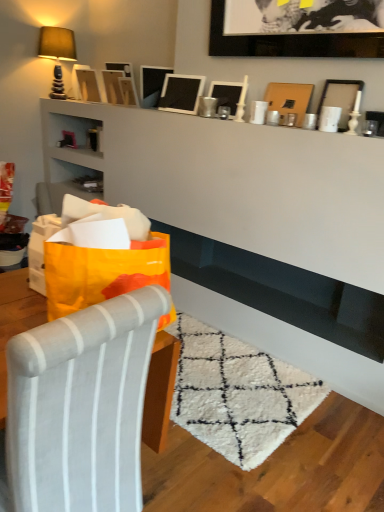
Question: Is orange paper bag at left thinner than matte brown picture frame at upper right, arranged as the 1th picture frame when viewed from the right?

Choices:
 (A) yes
 (B) no

Answer: (B)

Question: Considering the relative sizes of orange paper bag at left and matte brown picture frame at upper right, acting as the eighth picture frame starting from the left, in the image provided, is orange paper bag at left smaller than matte brown picture frame at upper right, acting as the eighth picture frame starting from the left,?

Choices:
 (A) yes
 (B) no

Answer: (B)

Question: Is orange paper bag at left facing towards matte brown picture frame at upper right, acting as the eighth picture frame starting from the left?

Choices:
 (A) yes
 (B) no

Answer: (B)

Question: Is orange paper bag at left touching matte brown picture frame at upper right, arranged as the 1th picture frame when viewed from the right?

Choices:
 (A) yes
 (B) no

Answer: (B)

Question: Considering the relative sizes of orange paper bag at left and matte brown picture frame at upper right, acting as the eighth picture frame starting from the left, in the image provided, is orange paper bag at left shorter than matte brown picture frame at upper right, acting as the eighth picture frame starting from the left,?

Choices:
 (A) yes
 (B) no

Answer: (B)

Question: From the image's perspective, is orange paper bag at left over matte brown picture frame at upper right, acting as the eighth picture frame starting from the left?

Choices:
 (A) no
 (B) yes

Answer: (A)

Question: From a real-world perspective, is metallic silver picture frame at upper center, positioned as the 3th picture frame in right-to-left order, physically above black matte picture frame at upper center, arranged as the 2th picture frame when viewed from the right?

Choices:
 (A) no
 (B) yes

Answer: (A)

Question: Is the depth of metallic silver picture frame at upper center, arranged as the 6th picture frame when viewed from the left, less than that of black matte picture frame at upper center, the seventh picture frame in the left-to-right sequence?

Choices:
 (A) no
 (B) yes

Answer: (A)

Question: From the image's perspective, would you say metallic silver picture frame at upper center, arranged as the 6th picture frame when viewed from the left, is shown under black matte picture frame at upper center, arranged as the 2th picture frame when viewed from the right?

Choices:
 (A) yes
 (B) no

Answer: (A)

Question: Is metallic silver picture frame at upper center, arranged as the 6th picture frame when viewed from the left, smaller than black matte picture frame at upper center, arranged as the 2th picture frame when viewed from the right?

Choices:
 (A) yes
 (B) no

Answer: (A)

Question: Is metallic silver picture frame at upper center, positioned as the 3th picture frame in right-to-left order, bigger than black matte picture frame at upper center, arranged as the 2th picture frame when viewed from the right?

Choices:
 (A) no
 (B) yes

Answer: (A)

Question: Is black matte picture frame at upper center, the seventh picture frame in the left-to-right sequence, a part of metallic silver picture frame at upper center, arranged as the 6th picture frame when viewed from the left?

Choices:
 (A) yes
 (B) no

Answer: (B)

Question: Is orange paper bag at left far from wooden picture frame at upper center, the third picture frame when ordered from left to right?

Choices:
 (A) yes
 (B) no

Answer: (A)